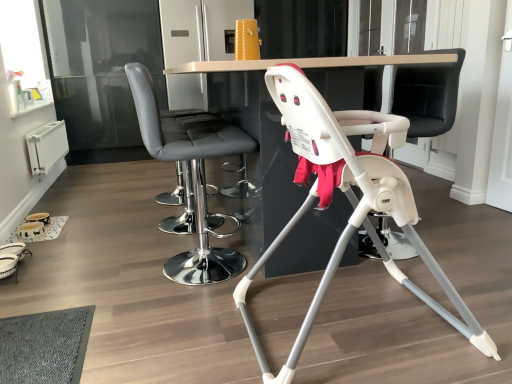
Question: From a real-world perspective, is white plastic swivel chair at center physically below matte gray bar stool at center, marked as the second chair in a right-to-left arrangement?

Choices:
 (A) no
 (B) yes

Answer: (A)

Question: Is white plastic swivel chair at center positioned before matte gray bar stool at center, which ranks as the first chair in left-to-right order?

Choices:
 (A) no
 (B) yes

Answer: (A)

Question: Is white plastic swivel chair at center further to the viewer compared to matte gray bar stool at center, which ranks as the first chair in left-to-right order?

Choices:
 (A) yes
 (B) no

Answer: (A)

Question: Is white plastic swivel chair at center positioned beyond the bounds of matte gray bar stool at center, which ranks as the first chair in left-to-right order?

Choices:
 (A) yes
 (B) no

Answer: (A)

Question: From the image's perspective, is white plastic swivel chair at center above matte gray bar stool at center, marked as the second chair in a right-to-left arrangement?

Choices:
 (A) no
 (B) yes

Answer: (B)

Question: From a real-world perspective, is matte gray bar stool at center, which ranks as the first chair in left-to-right order, physically located above or below white glossy table at center?

Choices:
 (A) below
 (B) above

Answer: (B)

Question: Looking at the image, does matte gray bar stool at center, marked as the second chair in a right-to-left arrangement, seem bigger or smaller compared to white glossy table at center?

Choices:
 (A) small
 (B) big

Answer: (A)

Question: Relative to white glossy table at center, is matte gray bar stool at center, marked as the second chair in a right-to-left arrangement, in front or behind?

Choices:
 (A) behind
 (B) front

Answer: (A)

Question: Considering the positions of matte gray bar stool at center, marked as the second chair in a right-to-left arrangement, and white glossy table at center in the image, is matte gray bar stool at center, marked as the second chair in a right-to-left arrangement, wider or thinner than white glossy table at center?

Choices:
 (A) wide
 (B) thin

Answer: (B)

Question: In terms of height, does white plastic swivel chair at center look taller or shorter compared to matte gray bar stool at center, which ranks as the first chair in left-to-right order?

Choices:
 (A) short
 (B) tall

Answer: (B)

Question: Is white plastic swivel chair at center inside or outside of matte gray bar stool at center, marked as the second chair in a right-to-left arrangement?

Choices:
 (A) outside
 (B) inside

Answer: (A)

Question: Is white plastic swivel chair at center in front of or behind matte gray bar stool at center, marked as the second chair in a right-to-left arrangement, in the image?

Choices:
 (A) front
 (B) behind

Answer: (B)

Question: Visually, is white plastic swivel chair at center positioned to the left or to the right of matte gray bar stool at center, which ranks as the first chair in left-to-right order?

Choices:
 (A) right
 (B) left

Answer: (A)

Question: Looking at the image, does white plastic swivel chair at center seem bigger or smaller compared to white plastic highchair at center, which is the first chair in right-to-left order?

Choices:
 (A) big
 (B) small

Answer: (B)

Question: Is white plastic swivel chair at center inside or outside of white plastic highchair at center, which is the first chair in right-to-left order?

Choices:
 (A) inside
 (B) outside

Answer: (B)